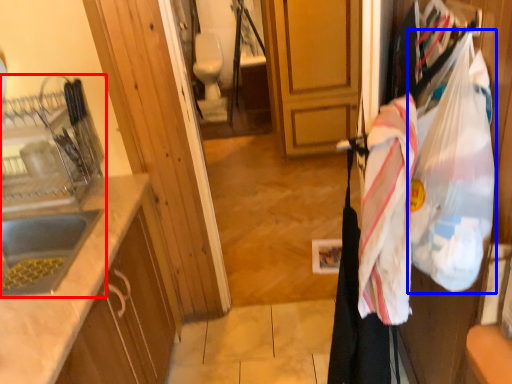
Question: Among these objects, which one is farthest to the camera, sink (highlighted by a red box) or grocery bag (highlighted by a blue box)?

Choices:
 (A) sink
 (B) grocery bag

Answer: (A)